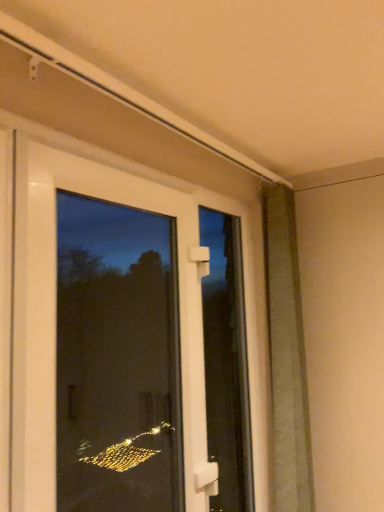
Question: Is green textured curtain at right shorter than white plastic handle at center?

Choices:
 (A) yes
 (B) no

Answer: (B)

Question: Is green textured curtain at right looking in the opposite direction of white plastic handle at center?

Choices:
 (A) yes
 (B) no

Answer: (B)

Question: From a real-world perspective, is green textured curtain at right positioned under white plastic handle at center based on gravity?

Choices:
 (A) no
 (B) yes

Answer: (A)

Question: Are green textured curtain at right and white plastic handle at center far apart?

Choices:
 (A) yes
 (B) no

Answer: (B)

Question: Is green textured curtain at right thinner than white plastic handle at center?

Choices:
 (A) yes
 (B) no

Answer: (B)

Question: Considering the relative positions of green textured curtain at right and white plastic handle at center in the image provided, is green textured curtain at right in front of white plastic handle at center?

Choices:
 (A) yes
 (B) no

Answer: (B)

Question: From the image's perspective, is white plastic handle at center on top of white plastic door at center?

Choices:
 (A) no
 (B) yes

Answer: (A)

Question: Is white plastic door at center completely or partially inside white plastic handle at center?

Choices:
 (A) no
 (B) yes

Answer: (A)

Question: Is white plastic handle at center oriented towards white plastic door at center?

Choices:
 (A) yes
 (B) no

Answer: (B)

Question: Can we say white plastic handle at center lies outside white plastic door at center?

Choices:
 (A) no
 (B) yes

Answer: (B)

Question: Can you confirm if white plastic handle at center is positioned to the right of white plastic door at center?

Choices:
 (A) yes
 (B) no

Answer: (A)

Question: Does white plastic handle at center touch white plastic door at center?

Choices:
 (A) no
 (B) yes

Answer: (A)

Question: Is white plastic door at center facing away from green textured curtain at right?

Choices:
 (A) no
 (B) yes

Answer: (A)